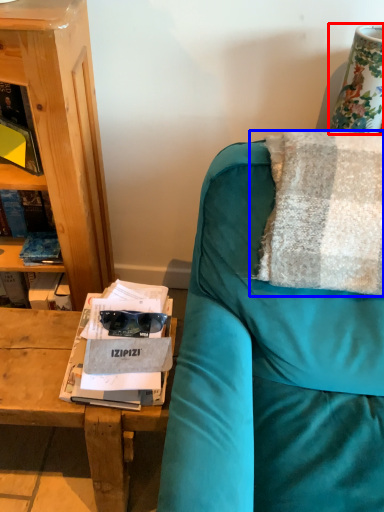
Question: Which object appears closest to the camera in this image, table lamp (highlighted by a red box) or pillow (highlighted by a blue box)?

Choices:
 (A) table lamp
 (B) pillow

Answer: (B)